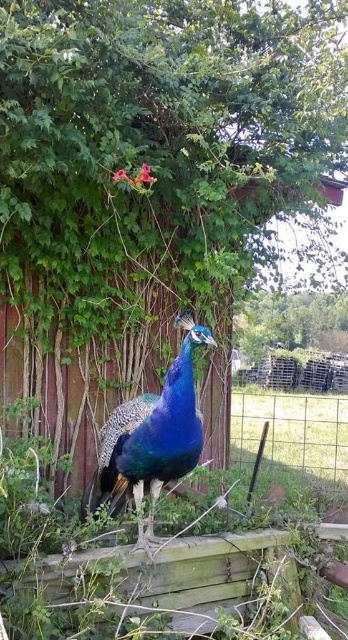
Between shiny blue peacock at center and wire mesh fence at lower right, which one appears on the left side from the viewer's perspective?

shiny blue peacock at center

Is point (156, 451) positioned behind point (266, 394)?

That is False.

Which is behind, point (160, 460) or point (240, 401)?

The point (240, 401) is behind.

In order to click on shiny blue peacock at center in this screenshot , I will do point(152,436).